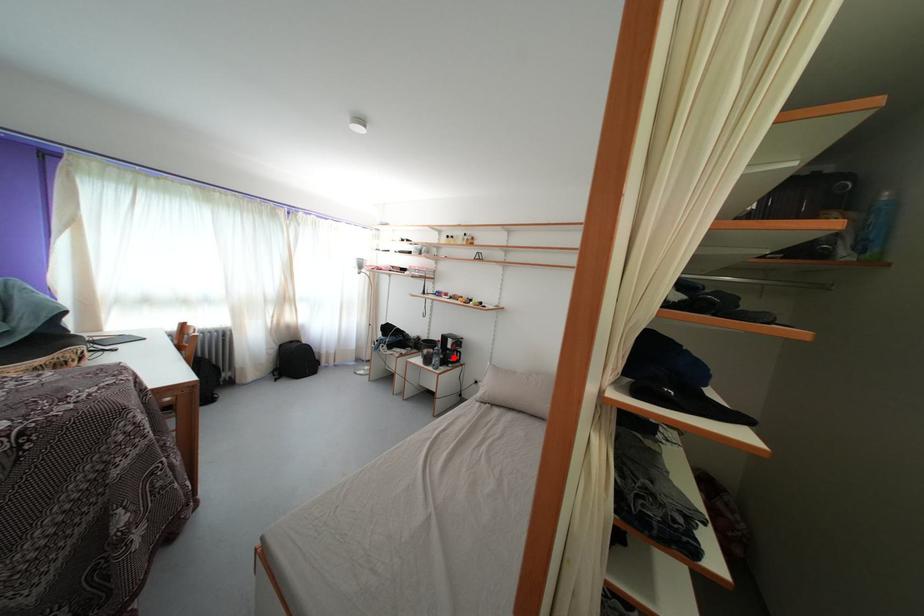
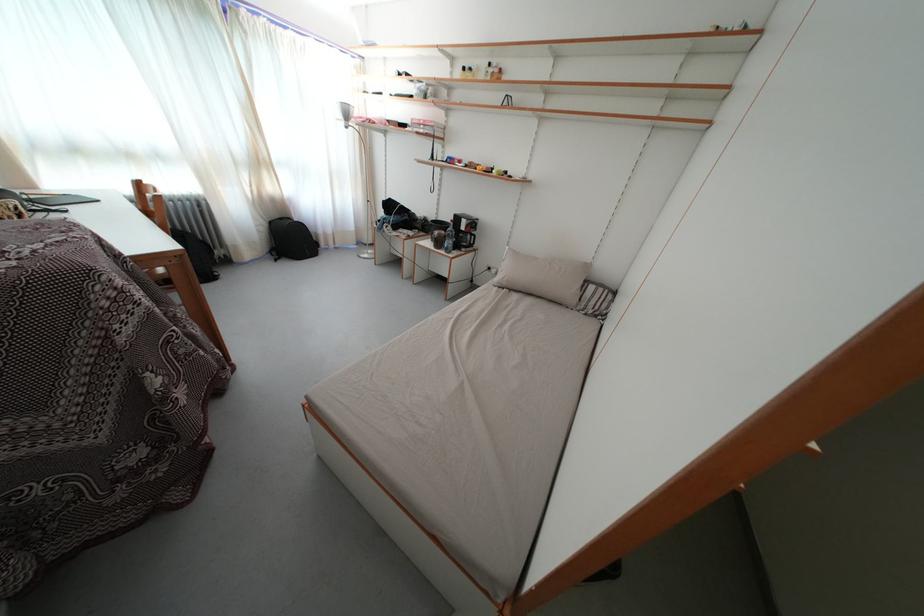
Locate, in the second image, the point that corresponds to the highlighted location in the first image.

(467, 240)